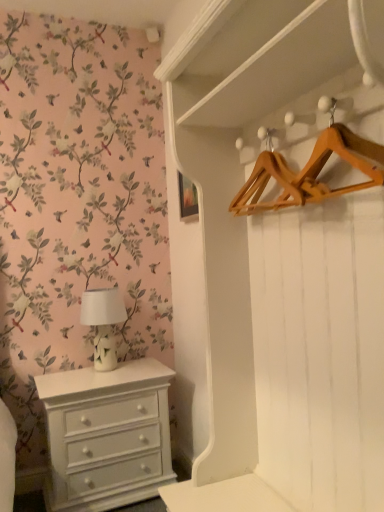
Where is `vacant space to the right of white glossy table lamp at left`? The height and width of the screenshot is (512, 384). vacant space to the right of white glossy table lamp at left is located at coordinates (148, 368).